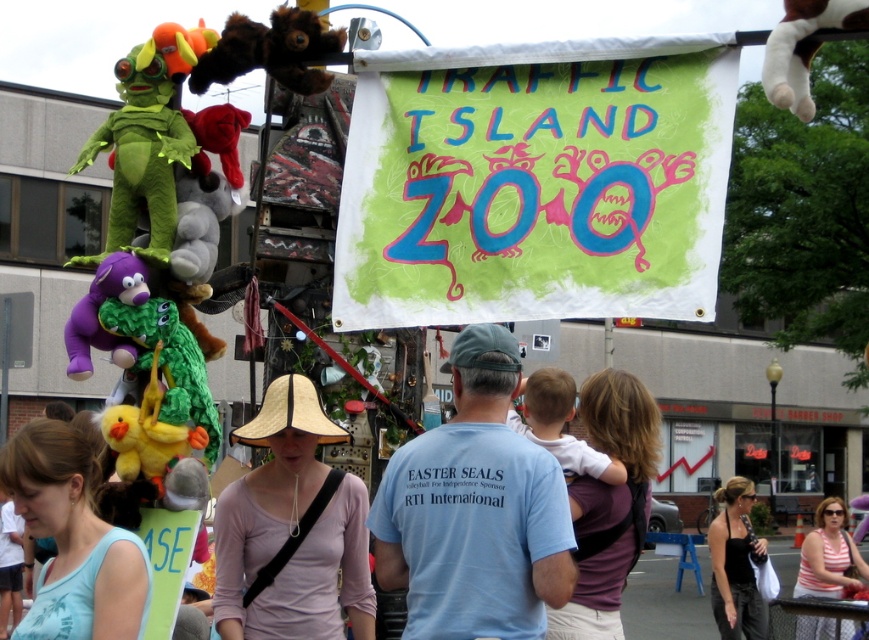
The height and width of the screenshot is (640, 869). I want to click on light blue cotton t-shirt at center, so click(x=474, y=509).

Based on the photo, can you confirm if light blue cotton t-shirt at center is thinner than yellow plush duck at center?

In fact, light blue cotton t-shirt at center might be wider than yellow plush duck at center.

Image resolution: width=869 pixels, height=640 pixels. I want to click on light blue cotton t-shirt at center, so click(474, 509).

The image size is (869, 640). What do you see at coordinates (735, 564) in the screenshot?
I see `black fabric dress at lower right` at bounding box center [735, 564].

The image size is (869, 640). I want to click on black fabric dress at lower right, so click(735, 564).

Where is `black fabric dress at lower right`? This screenshot has height=640, width=869. black fabric dress at lower right is located at coordinates 735,564.

Does light blue cotton t-shirt at center appear on the left side of black fabric dress at lower right?

Yes, light blue cotton t-shirt at center is to the left of black fabric dress at lower right.

Between light blue cotton t-shirt at center and black fabric dress at lower right, which one is positioned higher?

light blue cotton t-shirt at center is higher up.

Between point (568, 525) and point (728, 600), which one is positioned behind?

The point (728, 600) is more distant.

You are a GUI agent. You are given a task and a screenshot of the screen. Output one action in this format:
    pyautogui.click(x=<x>, y=<y>)
    Task: Click on the light blue cotton t-shirt at center
    This screenshot has width=869, height=640.
    Given the screenshot: What is the action you would take?
    pyautogui.click(x=474, y=509)